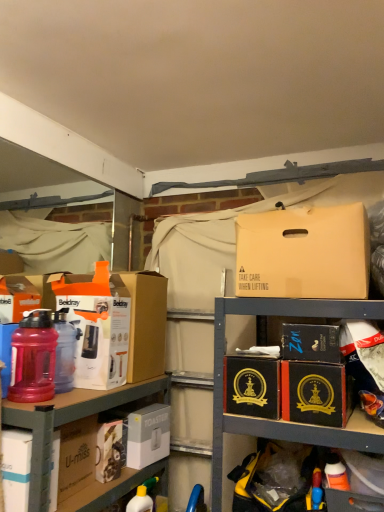
Image resolution: width=384 pixels, height=512 pixels. Identify the location of translucent plastic water bottle at left, the first bottle positioned from the front. (33, 358).

Measure the distance between point (70, 300) and camera.

Point (70, 300) and camera are 5.12 feet apart.

Image resolution: width=384 pixels, height=512 pixels. I want to click on matte white box at left, which is the 3th box in left-to-right order, so click(97, 327).

Describe the element at coordinates (316, 393) in the screenshot. The height and width of the screenshot is (512, 384). I see `black cardboard box at center-right, the 3th cardboard box from the left` at that location.

At what (x,y) coordinates should I click in order to perform the action: click on beige paper bag at upper center, marked as the second box in a right-to-left arrangement. Please return your answer as a coordinate pair (x, y). The image size is (384, 512). Looking at the image, I should click on (304, 253).

Is matte white box at left, acting as the 4th box starting from the right, spatially inside white matte toaster at lower left, or outside of it?

matte white box at left, acting as the 4th box starting from the right, exists outside the volume of white matte toaster at lower left.

Which is more to the left, matte white box at left, acting as the 4th box starting from the right, or white matte toaster at lower left?

matte white box at left, acting as the 4th box starting from the right.

Does matte white box at left, acting as the 4th box starting from the right, have a lesser height compared to white matte toaster at lower left?

No.

Is matte white box at left, acting as the 4th box starting from the right, further to the viewer compared to white matte toaster at lower left?

No, matte white box at left, acting as the 4th box starting from the right, is in front of white matte toaster at lower left.

Which of these two, black cardboard box at center-right, the 3th cardboard box from the left, or translucent plastic water bottle at left, positioned as the 2th bottle in back-to-front order, is wider?

black cardboard box at center-right, the 3th cardboard box from the left, is wider.

Is point (326, 393) positioned before point (28, 320)?

Yes.

Is black cardboard box at center-right, positioned as the first cardboard box in right-to-left order, placed right next to translucent plastic water bottle at left, the first bottle positioned from the front?

There is a gap between black cardboard box at center-right, positioned as the first cardboard box in right-to-left order, and translucent plastic water bottle at left, the first bottle positioned from the front.

From the image's perspective, is black cardboard box at center-right, the 3th cardboard box from the left, beneath translucent plastic water bottle at left, positioned as the 2th bottle in back-to-front order?

Yes.

Which of these two, white cardboard box at lower left, the fifth box viewed from the right, or white matte toaster at lower left, is smaller?

With smaller size is white matte toaster at lower left.

Could you tell me if white cardboard box at lower left, the fifth box viewed from the right, is turned towards white matte toaster at lower left?

No, white cardboard box at lower left, the fifth box viewed from the right, is not facing towards white matte toaster at lower left.

Is white cardboard box at lower left, the second box positioned from the left, at the right side of white matte toaster at lower left?

Incorrect, white cardboard box at lower left, the second box positioned from the left, is not on the right side of white matte toaster at lower left.

Locate an element on the screen. The image size is (384, 512). kit lying behind the white cardboard box at lower left, the fifth box viewed from the right is located at coordinates (109, 450).

How many degrees apart are the facing directions of matte black box at lower right and black cardboard box at center-right, positioned as the first cardboard box in right-to-left order?

The facing directions of matte black box at lower right and black cardboard box at center-right, positioned as the first cardboard box in right-to-left order, are 0.359 degrees apart.

From the picture: From the image's perspective, relative to black cardboard box at center-right, positioned as the first cardboard box in right-to-left order, is matte black box at lower right above or below?

Based on their image positions, matte black box at lower right is located beneath black cardboard box at center-right, positioned as the first cardboard box in right-to-left order.

Are matte black box at lower right and black cardboard box at center-right, the 3th cardboard box from the left, located far from each other?

No, matte black box at lower right is in close proximity to black cardboard box at center-right, the 3th cardboard box from the left.

Find the location of a particular element. kit behind the beige paper bag at upper center, the 5th box from the left is located at coordinates (109, 450).

In the scene shown: Who is more distant, white matte toaster at lower left or beige paper bag at upper center, the 5th box from the left?

white matte toaster at lower left.

From the image's perspective, between white matte toaster at lower left and beige paper bag at upper center, marked as the second box in a right-to-left arrangement, who is located below?

white matte toaster at lower left.

Is black cardboard box at center-right, arranged as the 6th box when viewed from the left, not near matte white box at left, which is the 3th box in left-to-right order?

That's not correct — black cardboard box at center-right, arranged as the 6th box when viewed from the left, is a little close to matte white box at left, which is the 3th box in left-to-right order.

Considering the relative positions of black cardboard box at center-right, positioned as the first box in right-to-left order, and matte white box at left, acting as the 4th box starting from the right, in the image provided, is black cardboard box at center-right, positioned as the first box in right-to-left order, to the right of matte white box at left, acting as the 4th box starting from the right, from the viewer's perspective?

Yes, black cardboard box at center-right, positioned as the first box in right-to-left order, is to the right of matte white box at left, acting as the 4th box starting from the right.

Between point (320, 328) and point (92, 374), which one is positioned in front?

Point (320, 328)

Is black cardboard box at center-right, arranged as the 6th box when viewed from the left, facing towards matte white box at left, acting as the 4th box starting from the right?

No, black cardboard box at center-right, arranged as the 6th box when viewed from the left, is not oriented towards matte white box at left, acting as the 4th box starting from the right.

Is black cardboard box at center-right, positioned as the first cardboard box in right-to-left order, facing towards white matte toaster at lower left?

No.

From a real-world perspective, starting from the white matte toaster at lower left, which cardboard box is the 1st one vertically above it? Please provide its 2D coordinates.

[(316, 393)]

Is black cardboard box at center-right, the 3th cardboard box from the left, taller or shorter than white matte toaster at lower left?

In the image, black cardboard box at center-right, the 3th cardboard box from the left, appears to be shorter than white matte toaster at lower left.

Which is in front, point (328, 383) or point (121, 460)?

Positioned in front is point (328, 383).

Where is `the 1st box counting from the left side of the white matte toaster at lower left`? the 1st box counting from the left side of the white matte toaster at lower left is located at coordinates (97, 327).

Locate an element on the screen. the 1st bottle behind the black cardboard box at center-right, positioned as the first cardboard box in right-to-left order, counting from the anchor's position is located at coordinates (33, 358).

Looking at the image, which one is located closer to white matte toaster at lower left, white plastic toaster at lower left, the 4th box positioned from the left, or matte plastic water bottle at left, which ranks as the 1th box in left-to-right order?

white plastic toaster at lower left, the 4th box positioned from the left, is closer to white matte toaster at lower left.

Which object lies nearer to the anchor point black cardboard box at center-right, positioned as the first cardboard box in right-to-left order, matte black box at lower right or white cardboard box at left, the third cardboard box from the right?

The object closer to black cardboard box at center-right, positioned as the first cardboard box in right-to-left order, is matte black box at lower right.

From the image, which object appears to be nearer to white plastic toaster at lower left, arranged as the third box when viewed from the right, white cardboard box at left, arranged as the first cardboard box when viewed from the left, or beige paper bag at upper center, marked as the second box in a right-to-left arrangement?

white cardboard box at left, arranged as the first cardboard box when viewed from the left, lies closer to white plastic toaster at lower left, arranged as the third box when viewed from the right, than the other object.

From the image, which object appears to be farther from matte black box at lower right, black cardboard box at center-right, positioned as the first box in right-to-left order, or black cardboard box at center, the second cardboard box in the right-to-left sequence?

Based on the image, black cardboard box at center-right, positioned as the first box in right-to-left order, appears to be further to matte black box at lower right.

Estimate the real-world distances between objects in this image. Which object is further from black cardboard box at center-right, arranged as the 6th box when viewed from the left, black cardboard box at center-right, the 3th cardboard box from the left, or beige paper bag at upper center, marked as the second box in a right-to-left arrangement?

beige paper bag at upper center, marked as the second box in a right-to-left arrangement, lies further to black cardboard box at center-right, arranged as the 6th box when viewed from the left, than the other object.

When comparing their distances from yellow matte bottle at lower center, does white matte toaster at lower left or matte plastic water bottle at left, the 2th bottle when ordered from front to back, seem further?

matte plastic water bottle at left, the 2th bottle when ordered from front to back, is further to yellow matte bottle at lower center.

When comparing their distances from translucent plastic water bottle at left, the first bottle positioned from the front, does white plastic toaster at lower left, arranged as the third box when viewed from the right, or matte black box at lower right seem further?

matte black box at lower right is positioned further to the anchor translucent plastic water bottle at left, the first bottle positioned from the front.

Considering their positions, is black cardboard box at center, the second cardboard box in the right-to-left sequence, positioned closer to matte white box at left, which is the 3th box in left-to-right order, than matte plastic water bottle at left, which is the 6th box in right-to-left order?

Among the two, matte plastic water bottle at left, which is the 6th box in right-to-left order, is located nearer to matte white box at left, which is the 3th box in left-to-right order.

At what (x,y) coordinates should I click in order to perform the action: click on cleaning product between matte plastic water bottle at left, the first bottle viewed from the back, and black cardboard box at center, which is the 2th cardboard box from left to right. Please return your answer as a coordinate pair (x, y). The image size is (384, 512). Looking at the image, I should click on (142, 497).

At what (x,y) coordinates should I click in order to perform the action: click on box between translucent plastic water bottle at left, positioned as the 2th bottle in back-to-front order, and white cardboard box at lower left, the second box positioned from the left, from top to bottom. Please return your answer as a coordinate pair (x, y). This screenshot has width=384, height=512. Looking at the image, I should click on [6, 354].

You are a GUI agent. You are given a task and a screenshot of the screen. Output one action in this format:
    pyautogui.click(x=<x>, y=<y>)
    Task: Click on the cleaning product located between translucent plastic water bottle at left, positioned as the 2th bottle in back-to-front order, and black cardboard box at center-right, positioned as the first cardboard box in right-to-left order, in the left-right direction
    
    Given the screenshot: What is the action you would take?
    pyautogui.click(x=142, y=497)

Find the location of a particular element. shelf that lies between matte plastic water bottle at left, the 2th bottle when ordered from front to back, and yellow matte bottle at lower center from top to bottom is located at coordinates (69, 422).